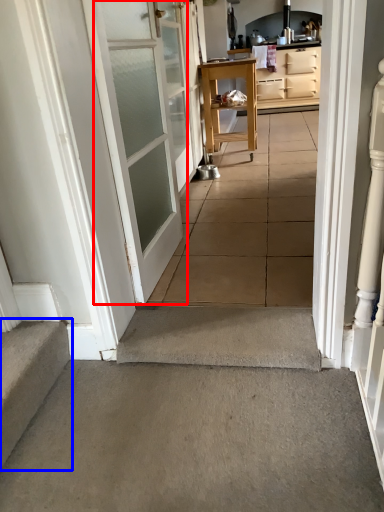
Question: Among these objects, which one is nearest to the camera, door (highlighted by a red box) or stairs (highlighted by a blue box)?

Choices:
 (A) door
 (B) stairs

Answer: (B)